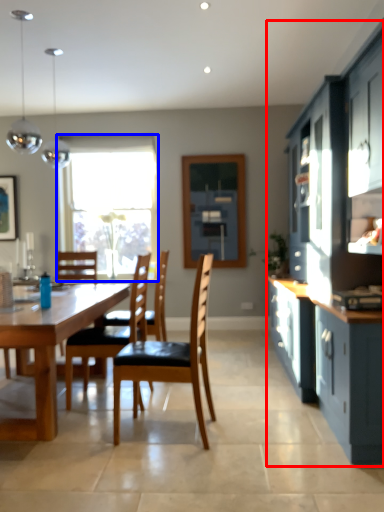
Question: Among these objects, which one is nearest to the camera, cabinetry (highlighted by a red box) or window (highlighted by a blue box)?

Choices:
 (A) cabinetry
 (B) window

Answer: (A)